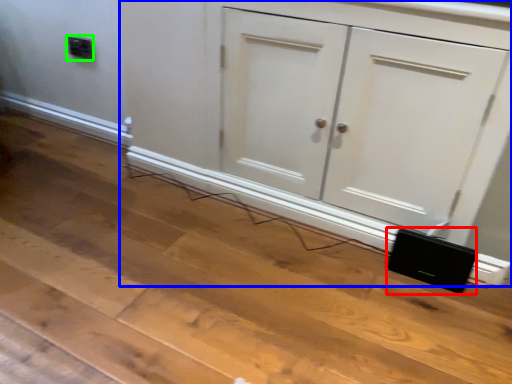
Question: Which object is the farthest from speaker (highlighted by a red box)? Choose among these: cupboard (highlighted by a blue box) or electric outlet (highlighted by a green box).

Choices:
 (A) cupboard
 (B) electric outlet

Answer: (B)